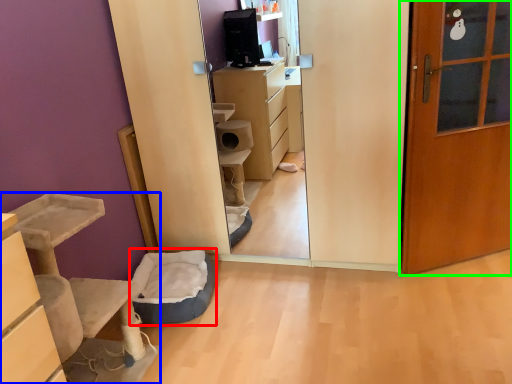
Question: Which object is positioned farthest from infant bed (highlighted by a red box)? Select from furniture (highlighted by a blue box) and door (highlighted by a green box).

Choices:
 (A) furniture
 (B) door

Answer: (B)